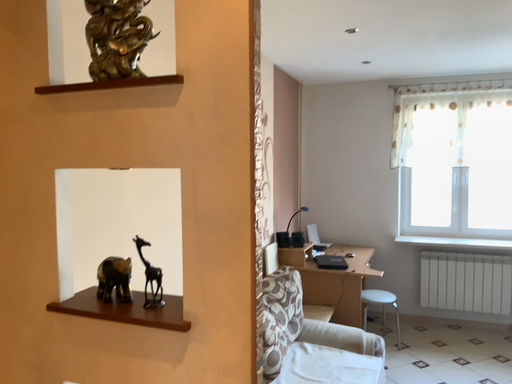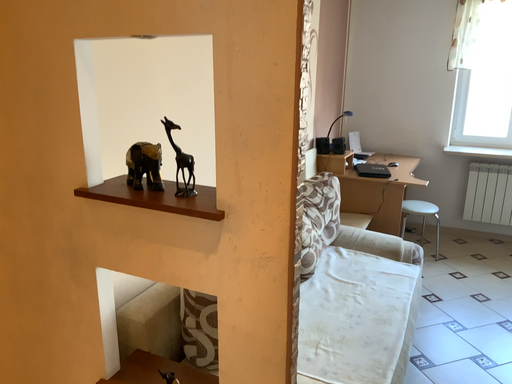
Question: How did the camera likely rotate when shooting the video?

Choices:
 (A) rotated downward
 (B) rotated upward

Answer: (A)